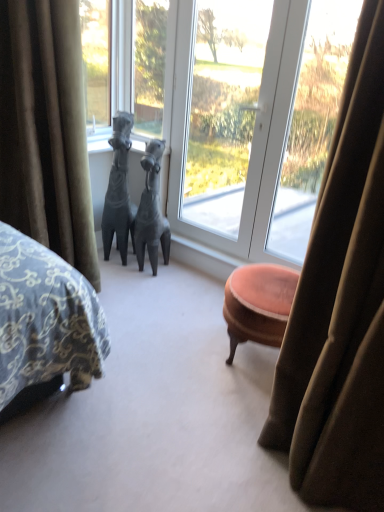
You are a GUI agent. You are given a task and a screenshot of the screen. Output one action in this format:
    pyautogui.click(x=<x>, y=<y>)
    Task: Click on the matte gray horse at center, which is counted as the second animal, starting from the left
    The height and width of the screenshot is (512, 384).
    Given the screenshot: What is the action you would take?
    pyautogui.click(x=151, y=211)

What do you see at coordinates (119, 191) in the screenshot? Image resolution: width=384 pixels, height=512 pixels. I see `matte gray horse at center, the 2th animal in the right-to-left sequence` at bounding box center [119, 191].

What is the approximate height of transparent glass window at center?

The height of transparent glass window at center is 1.55 meters.

Locate an element on the screen. The height and width of the screenshot is (512, 384). transparent glass window at center is located at coordinates (224, 110).

At what (x,y) coordinates should I click in order to perform the action: click on matte gray horse at center, acting as the first animal starting from the right. Please return your answer as a coordinate pair (x, y). Looking at the image, I should click on (151, 211).

In terms of size, does matte gray horse at center, the 2th animal in the right-to-left sequence, appear bigger or smaller than transparent glass window at center?

matte gray horse at center, the 2th animal in the right-to-left sequence, is smaller than transparent glass window at center.

Which object is positioned more to the left, matte gray horse at center, placed as the 1th animal when sorted from left to right, or transparent glass window at center?

matte gray horse at center, placed as the 1th animal when sorted from left to right.

In the scene shown: From a real-world perspective, relative to transparent glass window at center, is matte gray horse at center, placed as the 1th animal when sorted from left to right, vertically above or below?

matte gray horse at center, placed as the 1th animal when sorted from left to right, is below transparent glass window at center.

Is matte gray horse at center, placed as the 1th animal when sorted from left to right, looking in the opposite direction of transparent glass window at center?

matte gray horse at center, placed as the 1th animal when sorted from left to right, does not have its back to transparent glass window at center.

Which object is thinner, matte gray horse at center, the 2th animal in the right-to-left sequence, or transparent glass window at center?

transparent glass window at center is thinner.

Which is behind, point (129, 134) or point (277, 115)?

Point (129, 134)

Is transparent glass window at center at the back of velvet green curtain at left?

No, velvet green curtain at left is not facing the opposite direction of transparent glass window at center.

Is point (63, 94) farther from viewer compared to point (323, 58)?

No, (63, 94) is closer to viewer.

Which object is positioned more to the left, velvet green curtain at left or transparent glass window at center?

velvet green curtain at left.

Who is more distant, velvet green curtain at left or transparent glass window at center?

transparent glass window at center is behind.

Between transparent glass window at center and matte gray horse at center, placed as the 1th animal when sorted from left to right, which one has smaller size?

Smaller between the two is matte gray horse at center, placed as the 1th animal when sorted from left to right.

Who is shorter, transparent glass window at center or matte gray horse at center, placed as the 1th animal when sorted from left to right?

Standing shorter between the two is matte gray horse at center, placed as the 1th animal when sorted from left to right.

Does transparent glass window at center appear on the left side of matte gray horse at center, placed as the 1th animal when sorted from left to right?

Incorrect, transparent glass window at center is not on the left side of matte gray horse at center, placed as the 1th animal when sorted from left to right.

From the image's perspective, which one is positioned higher, transparent glass window at center or matte gray horse at center, the 2th animal in the right-to-left sequence?

transparent glass window at center, from the image's perspective.

Is velvet green curtain at left placed right next to matte gray horse at center, which is counted as the second animal, starting from the left?

velvet green curtain at left is not next to matte gray horse at center, which is counted as the second animal, starting from the left, and they're not touching.

Does velvet green curtain at left appear on the left side of matte gray horse at center, acting as the first animal starting from the right?

Yes, velvet green curtain at left is to the left of matte gray horse at center, acting as the first animal starting from the right.

From a real-world perspective, does velvet green curtain at left stand above matte gray horse at center, acting as the first animal starting from the right?

Yes, from a real-world perspective, velvet green curtain at left is on top of matte gray horse at center, acting as the first animal starting from the right.

Considering the sizes of objects velvet green curtain at left and matte gray horse at center, which is counted as the second animal, starting from the left, in the image provided, who is shorter, velvet green curtain at left or matte gray horse at center, which is counted as the second animal, starting from the left,?

matte gray horse at center, which is counted as the second animal, starting from the left, is shorter.

Is matte gray horse at center, acting as the first animal starting from the right, positioned beyond the bounds of transparent glass window at center?

Absolutely, matte gray horse at center, acting as the first animal starting from the right, is external to transparent glass window at center.

From a real-world perspective, who is located higher, matte gray horse at center, acting as the first animal starting from the right, or transparent glass window at center?

From a 3D spatial view, transparent glass window at center is above.

From the image's perspective, is matte gray horse at center, acting as the first animal starting from the right, on top of transparent glass window at center?

No, from the image's perspective, matte gray horse at center, acting as the first animal starting from the right, is not on top of transparent glass window at center.

Would you say matte gray horse at center, the 2th animal in the right-to-left sequence, is to the left or to the right of matte gray horse at center, which is counted as the second animal, starting from the left, in the picture?

From the image, it's evident that matte gray horse at center, the 2th animal in the right-to-left sequence, is to the left of matte gray horse at center, which is counted as the second animal, starting from the left.

Is matte gray horse at center, the 2th animal in the right-to-left sequence, turned away from matte gray horse at center, acting as the first animal starting from the right?

No, matte gray horse at center, the 2th animal in the right-to-left sequence, is not facing away from matte gray horse at center, acting as the first animal starting from the right.

Which of these two, matte gray horse at center, the 2th animal in the right-to-left sequence, or matte gray horse at center, acting as the first animal starting from the right, is bigger?

matte gray horse at center, the 2th animal in the right-to-left sequence, is bigger.

Find the location of a particular element. The height and width of the screenshot is (512, 384). window screen above the matte gray horse at center, the 2th animal in the right-to-left sequence (from the image's perspective) is located at coordinates (224, 110).

Locate an element on the screen. This screenshot has width=384, height=512. window that is on the right side of matte gray horse at center, placed as the 1th animal when sorted from left to right is located at coordinates (243, 121).

From the image, which object appears to be nearer to transparent glass window at center, matte gray horse at center, acting as the first animal starting from the right, or transparent glass window at center?

Based on the image, transparent glass window at center appears to be nearer to transparent glass window at center.

Based on their spatial positions, is transparent glass window at center or transparent glass window at center closer to velvet green curtain at left?

transparent glass window at center lies closer to velvet green curtain at left than the other object.

When comparing their distances from matte gray horse at center, acting as the first animal starting from the right, does transparent glass window at center or transparent glass window at center seem closer?

Based on the image, transparent glass window at center appears to be nearer to matte gray horse at center, acting as the first animal starting from the right.

Estimate the real-world distances between objects in this image. Which object is closer to transparent glass window at center, matte gray horse at center, acting as the first animal starting from the right, or matte gray horse at center, placed as the 1th animal when sorted from left to right?

matte gray horse at center, acting as the first animal starting from the right, lies closer to transparent glass window at center than the other object.

Looking at this image, considering their positions, is transparent glass window at center positioned closer to matte gray horse at center, placed as the 1th animal when sorted from left to right, than transparent glass window at center?

Based on the image, transparent glass window at center appears to be nearer to matte gray horse at center, placed as the 1th animal when sorted from left to right.

Based on their spatial positions, is velvet green curtain at left or matte gray horse at center, acting as the first animal starting from the right, closer to matte gray horse at center, placed as the 1th animal when sorted from left to right?

The object closer to matte gray horse at center, placed as the 1th animal when sorted from left to right, is matte gray horse at center, acting as the first animal starting from the right.

Based on their spatial positions, is transparent glass window at center or matte gray horse at center, which is counted as the second animal, starting from the left, closer to transparent glass window at center?

The object closer to transparent glass window at center is transparent glass window at center.

Which object lies further to the anchor point matte gray horse at center, the 2th animal in the right-to-left sequence, transparent glass window at center or velvet green curtain at left?

velvet green curtain at left is further to matte gray horse at center, the 2th animal in the right-to-left sequence.

Locate an element on the screen. This screenshot has height=512, width=384. animal positioned between velvet green curtain at left and matte gray horse at center, acting as the first animal starting from the right, from near to far is located at coordinates (119, 191).

Image resolution: width=384 pixels, height=512 pixels. Find the location of `window screen between matte gray horse at center, acting as the first animal starting from the right, and transparent glass window at center from left to right`. window screen between matte gray horse at center, acting as the first animal starting from the right, and transparent glass window at center from left to right is located at coordinates (224, 110).

Locate an element on the screen. window screen located between velvet green curtain at left and transparent glass window at center in the left-right direction is located at coordinates (224, 110).

Locate an element on the screen. The height and width of the screenshot is (512, 384). animal between matte gray horse at center, placed as the 1th animal when sorted from left to right, and transparent glass window at center, in the horizontal direction is located at coordinates (151, 211).